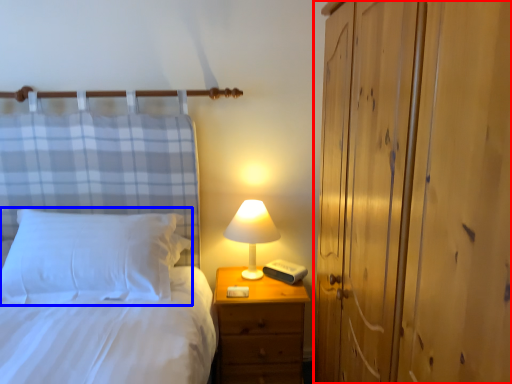
Question: Which object is further to the camera taking this photo, dresser (highlighted by a red box) or pillow (highlighted by a blue box)?

Choices:
 (A) dresser
 (B) pillow

Answer: (B)